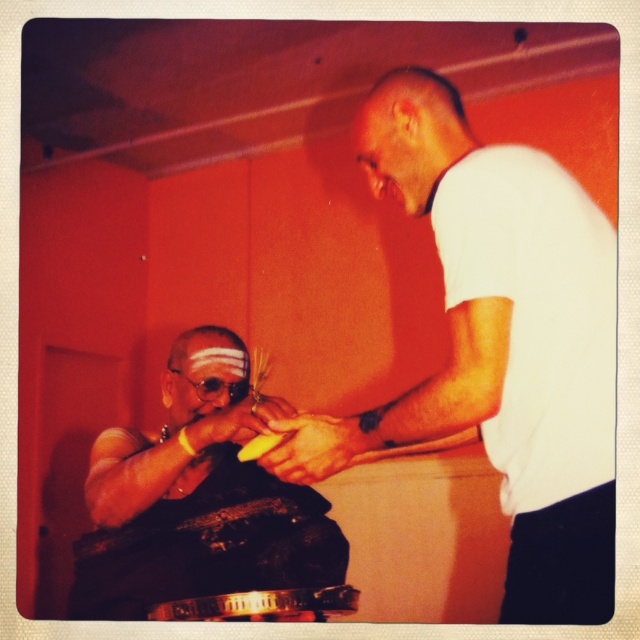
In the scene shown: You are a photographer trying to capture a closeup of the white matte shirt at center. The camera you are using has a minimum focusing distance of 3 feet. Can you take the photo without moving either the camera or the subject?

The white matte shirt at center and camera are 3.56 feet apart, which is greater than the minimum focusing distance of 3 feet. Therefore, you can take the photo without moving either the camera or the subject.

You are a photographer positioned in front of the scene. You notice the white matte shirt at center and the matte black cloth at center. Which object would appear larger in your camera frame?

The white matte shirt at center would appear larger in the camera frame because it is closer to the viewer than the matte black cloth at center.

You are a fashion designer observing the two garments in the scene. The white matte shirt at center and the matte black cloth at center are both placed on a mannequin. Which garment would you say has a bigger size?

The white matte shirt at center has a larger size compared to the matte black cloth at center, so the white matte shirt at center is bigger.